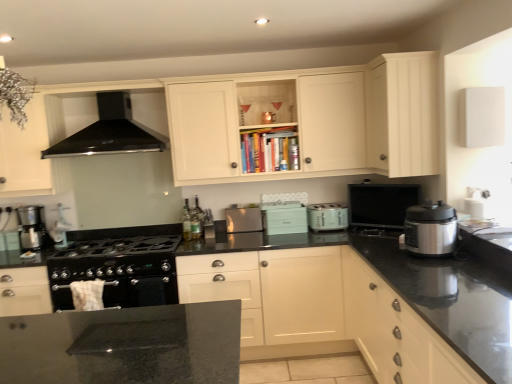
Where is `free location above matte silver toaster at center, arranged as the third kitchen appliance when viewed from the left (from a real-world perspective)`? The height and width of the screenshot is (384, 512). free location above matte silver toaster at center, arranged as the third kitchen appliance when viewed from the left (from a real-world perspective) is located at coordinates (327, 207).